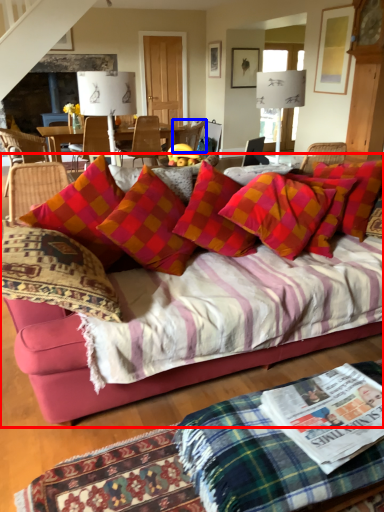
Question: Which object appears farthest to the camera in this image, studio couch (highlighted by a red box) or chair (highlighted by a blue box)?

Choices:
 (A) studio couch
 (B) chair

Answer: (B)